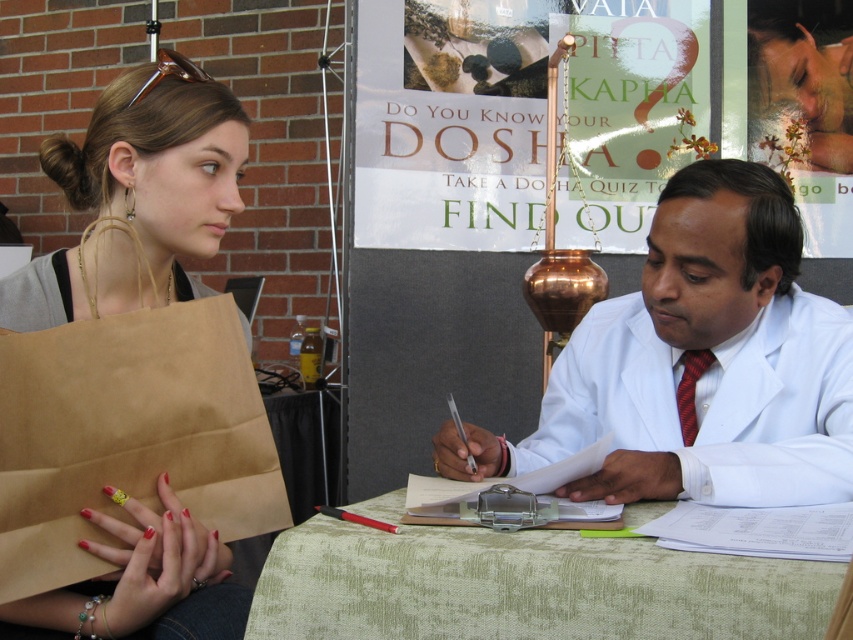
You are standing at the health event and see two points marked on the floor. The first point is at coordinate point (744, 358) and the second point is at coordinate point (712, 355). If you want to walk towards the dosha quiz poster, which point should you step on first?

Point (744, 358) is in front of point (712, 355). Therefore, to walk towards the dosha quiz poster, you should step on point (744, 358) first as it is closer to your current position.

You are attending the Ayurveda event and see the brown paper bag at left and the green fabric table at center. Which object is located to the left of the other?

The brown paper bag at left is positioned on the left side of green fabric table at center.

You are organizing a booth at the Ayurveda event and need to place a name tag on the green fabric table at center and the red silk tie at right. Since the name tags are the same size, which object should you place the name tag on first to ensure it fits properly?

The green fabric table at center is larger in size than the red silk tie at right, so you should place the name tag on the green fabric table at center first to ensure it fits properly.